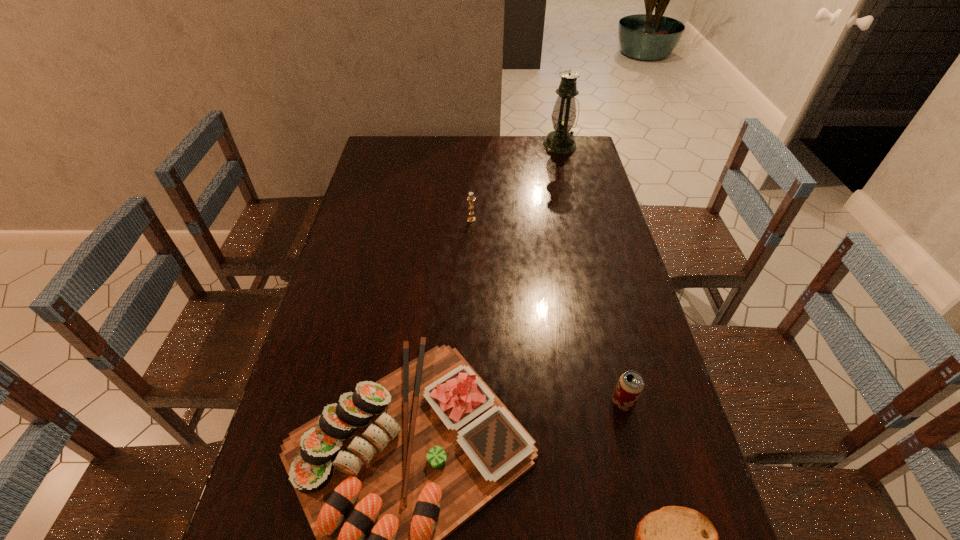
The image size is (960, 540). I want to click on object that is at the far right corner, so click(x=560, y=141).

Locate an element on the screen. The height and width of the screenshot is (540, 960). blank space at the far edge of the desktop is located at coordinates (413, 147).

Identify the location of free space at the left edge of the desktop. The width and height of the screenshot is (960, 540). (276, 474).

Find the location of `vacant space at the right edge`. vacant space at the right edge is located at coordinates (662, 479).

At what (x,y) coordinates should I click in order to perform the action: click on vacant point at the far right corner. Please return your answer as a coordinate pair (x, y). Looking at the image, I should click on (590, 158).

Identify the location of vacant area that lies between the fourth nearest object and the beer can. The height and width of the screenshot is (540, 960). (547, 311).

Identify the location of unoccupied area between the fourth nearest object and the beer can. This screenshot has height=540, width=960. (547, 311).

This screenshot has height=540, width=960. In order to click on object that is the fourth closest to the platter in this screenshot , I will do `click(560, 141)`.

What are the coordinates of `object that can be found as the closest to the second shortest object` in the screenshot? It's located at (674, 539).

This screenshot has height=540, width=960. Find the location of `vacant space that satisfies the following two spatial constraints: 1. on the back side of the second farthest object; 2. on the right side of the tallest object`. vacant space that satisfies the following two spatial constraints: 1. on the back side of the second farthest object; 2. on the right side of the tallest object is located at coordinates (473, 145).